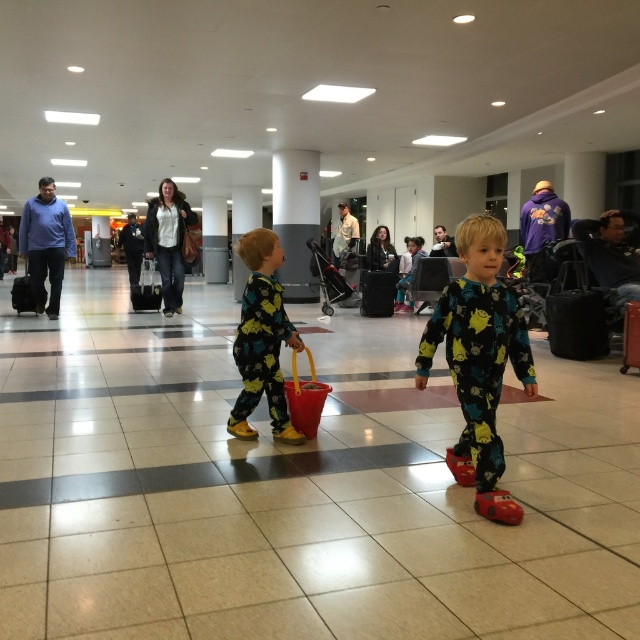
Can you confirm if printed fabric pajamas at center is thinner than yellow matte pajamas at center?

In fact, printed fabric pajamas at center might be wider than yellow matte pajamas at center.

How distant is printed fabric pajamas at center from yellow matte pajamas at center?

printed fabric pajamas at center and yellow matte pajamas at center are 4.80 feet apart from each other.

Locate an element on the screen. printed fabric pajamas at center is located at coordinates (477, 344).

At what (x,y) coordinates should I click in order to perform the action: click on printed fabric pajamas at center. Please return your answer as a coordinate pair (x, y). Looking at the image, I should click on (477, 344).

The image size is (640, 640). What do you see at coordinates (477, 344) in the screenshot? I see `printed fabric pajamas at center` at bounding box center [477, 344].

Can you confirm if printed fabric pajamas at center is taller than black fabric suitcase at right?

No.

Who is more forward, (440,320) or (561,337)?

Point (440,320)

This screenshot has height=640, width=640. I want to click on printed fabric pajamas at center, so click(x=477, y=344).

The image size is (640, 640). What are the coordinates of `printed fabric pajamas at center` in the screenshot? It's located at (477, 344).

Does printed fabric pajamas at center appear on the left side of black matte suitcase at center?

Yes, printed fabric pajamas at center is to the left of black matte suitcase at center.

Does point (481, 234) lie behind point (368, 308)?

That is False.

Where is `printed fabric pajamas at center`? This screenshot has width=640, height=640. printed fabric pajamas at center is located at coordinates (477, 344).